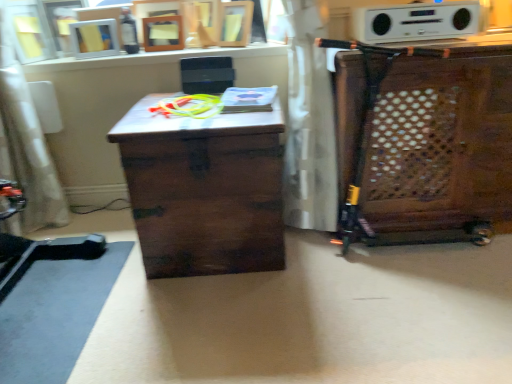
Question: Considering the relative positions of wooden cabinet at right and white plastic stereo at upper center in the image provided, is wooden cabinet at right in front of white plastic stereo at upper center?

Choices:
 (A) yes
 (B) no

Answer: (A)

Question: Would you say white plastic stereo at upper center is part of wooden cabinet at right's contents?

Choices:
 (A) no
 (B) yes

Answer: (A)

Question: Is wooden cabinet at right to the left of white plastic stereo at upper center from the viewer's perspective?

Choices:
 (A) no
 (B) yes

Answer: (A)

Question: Considering the relative sizes of wooden cabinet at right and white plastic stereo at upper center in the image provided, is wooden cabinet at right taller than white plastic stereo at upper center?

Choices:
 (A) yes
 (B) no

Answer: (A)

Question: Is wooden cabinet at right smaller than white plastic stereo at upper center?

Choices:
 (A) yes
 (B) no

Answer: (B)

Question: From the image's perspective, is white plastic stereo at upper center above or below white fabric swivel chair at left?

Choices:
 (A) above
 (B) below

Answer: (A)

Question: Considering the positions of white plastic stereo at upper center and white fabric swivel chair at left in the image, is white plastic stereo at upper center bigger or smaller than white fabric swivel chair at left?

Choices:
 (A) big
 (B) small

Answer: (B)

Question: From a real-world perspective, is white plastic stereo at upper center physically located above or below white fabric swivel chair at left?

Choices:
 (A) above
 (B) below

Answer: (A)

Question: Do you think white plastic stereo at upper center is within white fabric swivel chair at left, or outside of it?

Choices:
 (A) outside
 (B) inside

Answer: (A)

Question: Is white fabric swivel chair at left situated inside dark wood trunk at center or outside?

Choices:
 (A) inside
 (B) outside

Answer: (B)

Question: Is point (32, 213) closer or farther from the camera than point (136, 114)?

Choices:
 (A) farther
 (B) closer

Answer: (A)

Question: Based on their sizes in the image, would you say white fabric swivel chair at left is bigger or smaller than dark wood trunk at center?

Choices:
 (A) big
 (B) small

Answer: (B)

Question: In terms of height, does white fabric swivel chair at left look taller or shorter compared to dark wood trunk at center?

Choices:
 (A) tall
 (B) short

Answer: (A)

Question: Is white matte picture frame at upper left spatially inside wooden cabinet at right, or outside of it?

Choices:
 (A) inside
 (B) outside

Answer: (B)

Question: From a real-world perspective, relative to wooden cabinet at right, is white matte picture frame at upper left vertically above or below?

Choices:
 (A) above
 (B) below

Answer: (A)